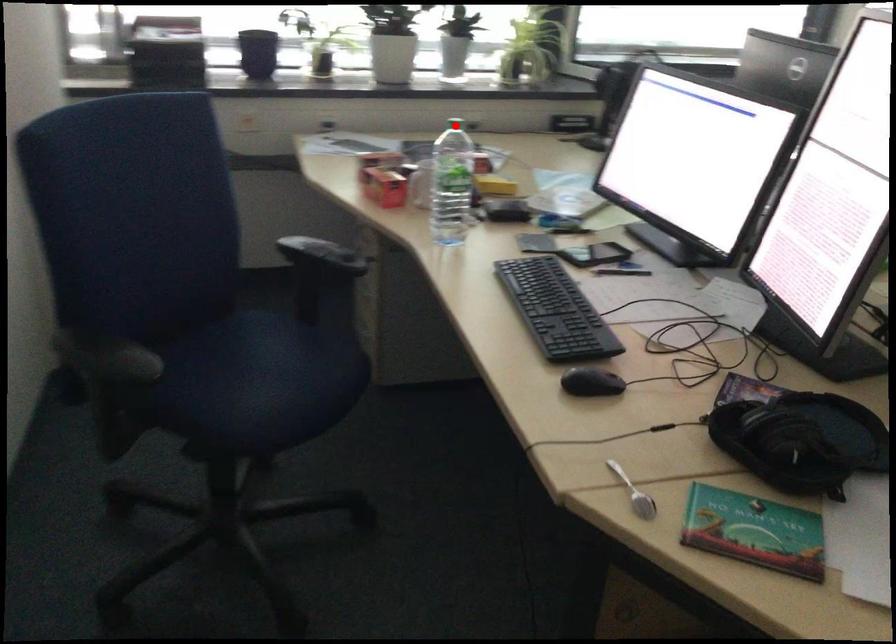
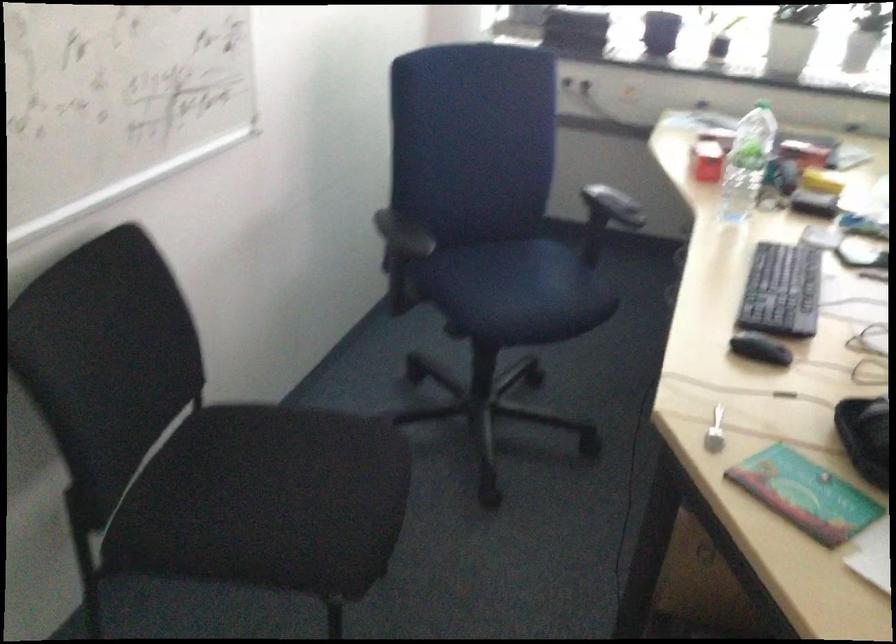
Question: I am providing you with two images of the same scene from different viewpoints. In image1, a red point is highlighted. Considering the same 3D point in image2, which of the following is correct?

Choices:
 (A) It is closer
 (B) It is farther

Answer: (B)